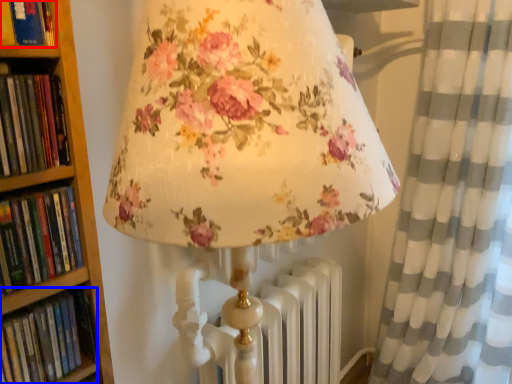
Question: Which object appears farthest to the camera in this image, book (highlighted by a red box) or book (highlighted by a blue box)?

Choices:
 (A) book
 (B) book

Answer: (B)